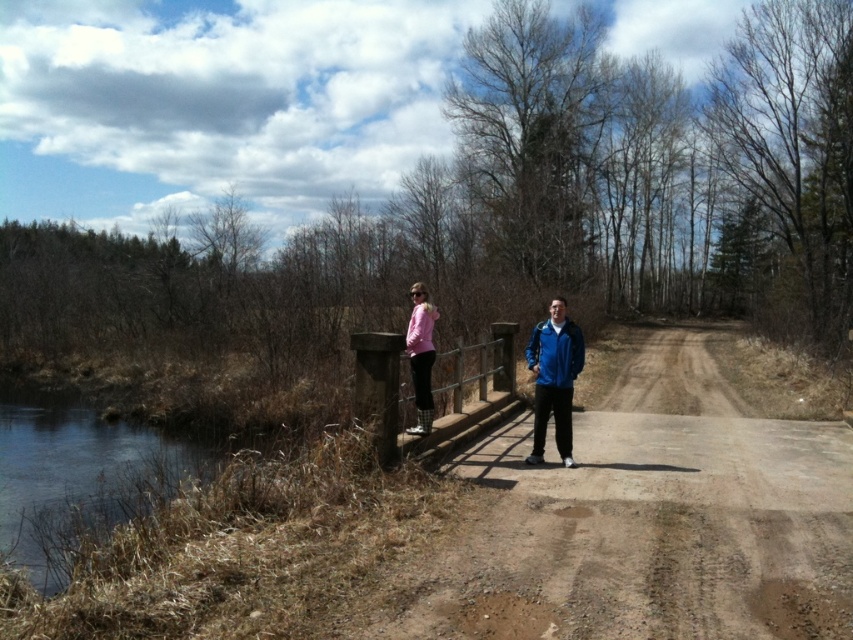
Question: Can you confirm if clear water at lower left is positioned below pink matte jacket at center?

Choices:
 (A) no
 (B) yes

Answer: (B)

Question: Which object appears farthest from the camera in this image?

Choices:
 (A) wooden bridge at center
 (B) clear water at lower left
 (C) matte pink sweater at center
 (D) pink matte jacket at center

Answer: (A)

Question: Is brown dirt track at center thinner than clear water at lower left?

Choices:
 (A) yes
 (B) no

Answer: (A)

Question: Which of the following is the farthest from the observer?

Choices:
 (A) (48, 470)
 (B) (505, 369)
 (C) (827, 444)

Answer: (A)

Question: Which point is closer to the camera taking this photo?

Choices:
 (A) (567, 465)
 (B) (416, 314)
 (C) (433, 436)
 (D) (53, 426)

Answer: (B)

Question: In this image, where is brown dirt track at center located relative to blue fabric jacket at center?

Choices:
 (A) above
 (B) below

Answer: (B)